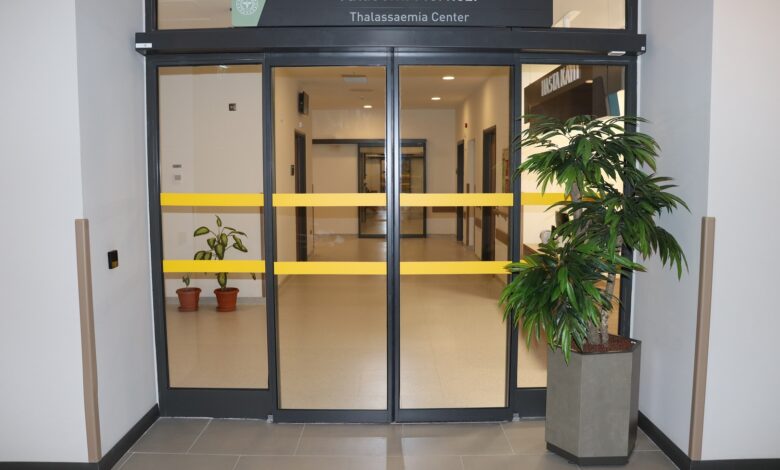
Where is `corner guards`? This screenshot has width=780, height=470. corner guards is located at coordinates (699, 381), (87, 327).